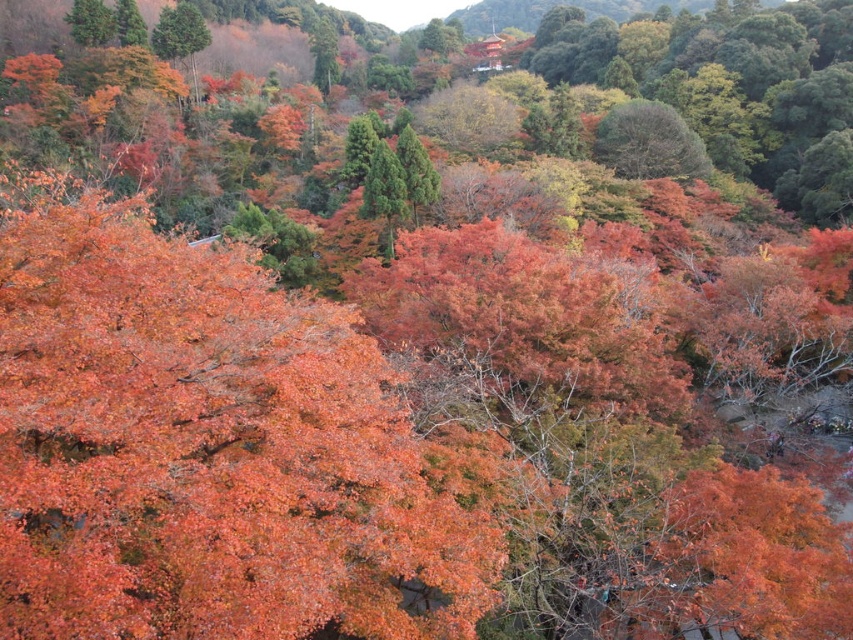
Is shiny orange leaves at center taller than dark green textured tree at upper center?

No, shiny orange leaves at center is not taller than dark green textured tree at upper center.

Between shiny orange leaves at center and dark green textured tree at upper center, which one is positioned lower?

Positioned lower is shiny orange leaves at center.

Where is `shiny orange leaves at center`? The height and width of the screenshot is (640, 853). shiny orange leaves at center is located at coordinates tap(206, 449).

What are the coordinates of `shiny orange leaves at center` in the screenshot? It's located at (206, 449).